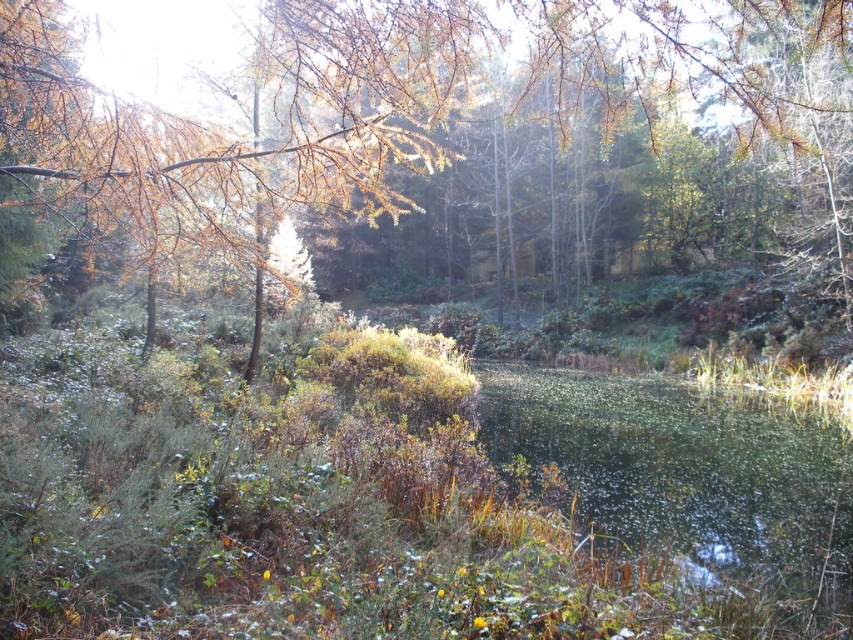
Question: Among these objects, which one is nearest to the camera?

Choices:
 (A) golden-brown branches at upper left
 (B) green leafy water at center

Answer: (A)

Question: Does golden-brown branches at upper left have a greater width compared to green leafy water at center?

Choices:
 (A) no
 (B) yes

Answer: (B)

Question: Is golden-brown branches at upper left to the left of green leafy water at center from the viewer's perspective?

Choices:
 (A) no
 (B) yes

Answer: (B)

Question: Is golden-brown branches at upper left above green leafy water at center?

Choices:
 (A) no
 (B) yes

Answer: (B)